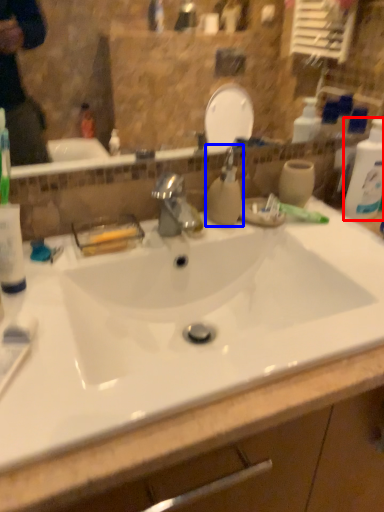
Question: Which point is closer to the camera, cleaning product (highlighted by a red box) or soap dispenser (highlighted by a blue box)?

Choices:
 (A) cleaning product
 (B) soap dispenser

Answer: (B)